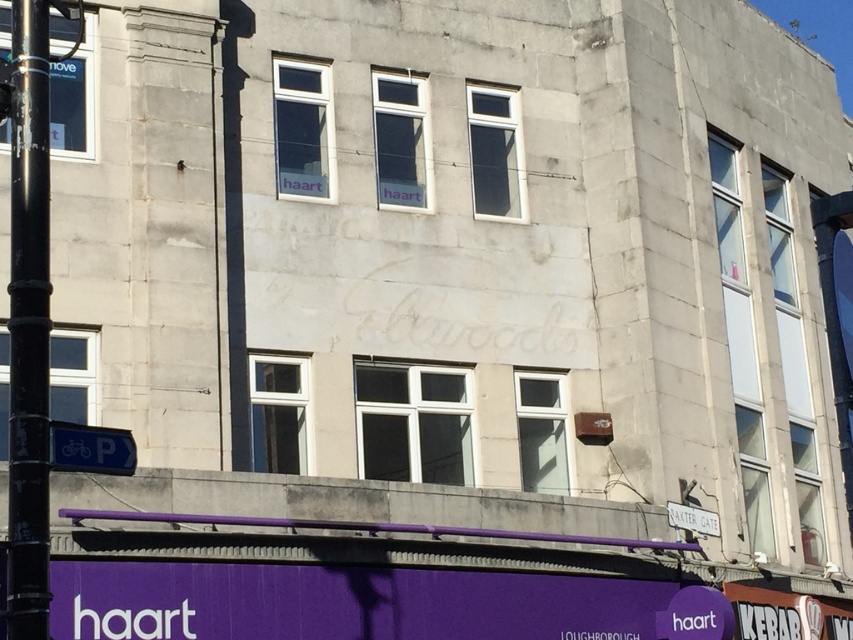
Question: Which object is farther from the camera taking this photo?

Choices:
 (A) white plastic sign at lower right
 (B) black metallic pole at left

Answer: (A)

Question: Which of the following is the farthest from the observer?

Choices:
 (A) (74, 429)
 (B) (42, 180)
 (C) (715, 518)

Answer: (C)

Question: Which of the following is the farthest from the observer?

Choices:
 (A) white plastic sign at lower right
 (B) blue plastic parking sign at lower left

Answer: (A)

Question: From the image, what is the correct spatial relationship of black metallic pole at left in relation to white plastic sign at lower right?

Choices:
 (A) below
 (B) above

Answer: (B)

Question: Considering the relative positions of blue plastic parking sign at lower left and white plastic sign at lower right in the image provided, where is blue plastic parking sign at lower left located with respect to white plastic sign at lower right?

Choices:
 (A) above
 (B) below

Answer: (A)

Question: Does blue plastic parking sign at lower left appear on the right side of white plastic sign at lower right?

Choices:
 (A) no
 (B) yes

Answer: (A)